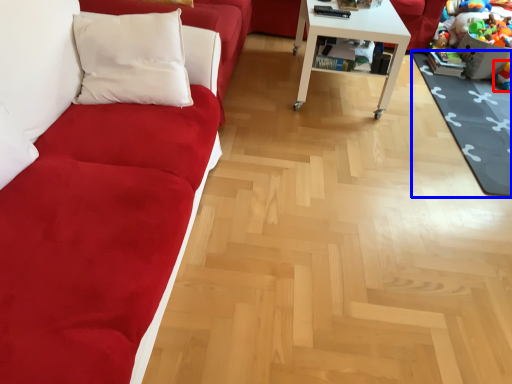
Question: Among these objects, which one is nearest to the camera, toy (highlighted by a red box) or mat (highlighted by a blue box)?

Choices:
 (A) toy
 (B) mat

Answer: (B)